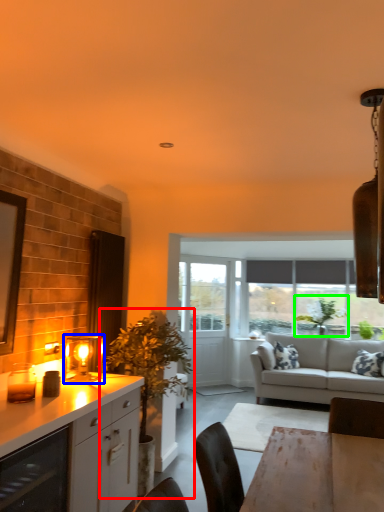
Question: Which object is the closest to the houseplant (highlighted by a red box)? Choose among these: light fixture (highlighted by a blue box) or plant (highlighted by a green box).

Choices:
 (A) light fixture
 (B) plant

Answer: (A)